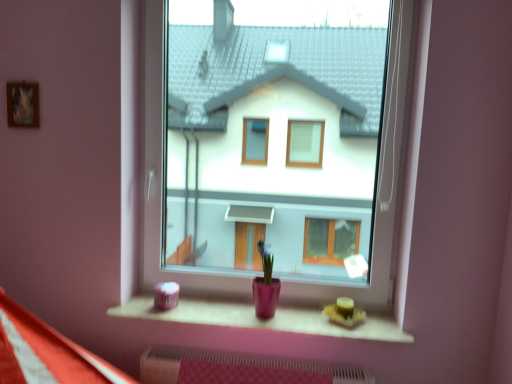
At what (x,y) coordinates should I click in order to perform the action: click on free spot above matte pink wood at lower center (from a real-world perspective). Please return your answer as a coordinate pair (x, y). This screenshot has width=512, height=384. Looking at the image, I should click on (268, 318).